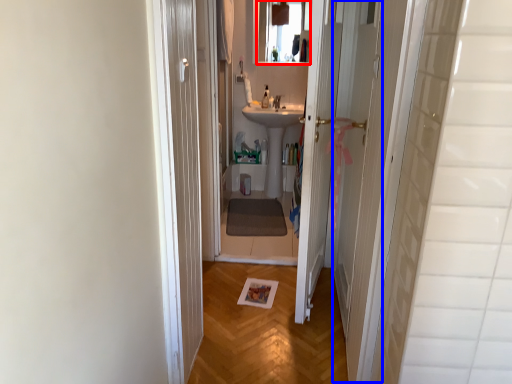
Question: Which of the following is the farthest to the observer, mirror (highlighted by a red box) or screen door (highlighted by a blue box)?

Choices:
 (A) mirror
 (B) screen door

Answer: (A)